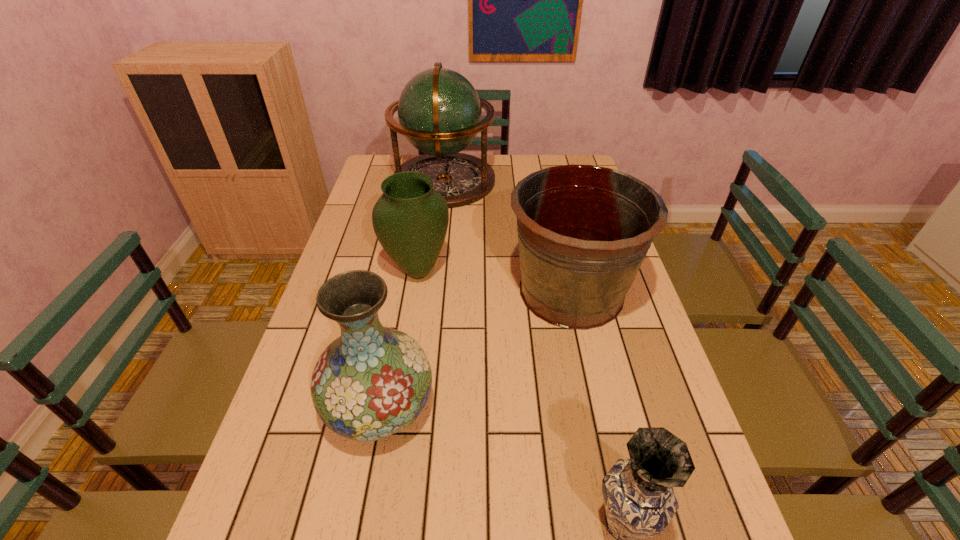
Where is `the farthest object`? The width and height of the screenshot is (960, 540). the farthest object is located at coordinates (439, 111).

Image resolution: width=960 pixels, height=540 pixels. Find the location of `the tallest object`. the tallest object is located at coordinates (439, 111).

Locate an element on the screen. Image resolution: width=960 pixels, height=540 pixels. the second nearest object is located at coordinates (371, 382).

Where is `the second farthest vase`? the second farthest vase is located at coordinates (371, 382).

I want to click on bucket, so click(x=583, y=231).

Locate an element on the screen. This screenshot has height=540, width=960. the farthest vase is located at coordinates (410, 219).

What are the coordinates of `vacant region located 0.200m on the front-facing side of the farthest object` in the screenshot? It's located at (546, 181).

At what (x,y) coordinates should I click in order to perform the action: click on vacant space situated on the back of the second nearest vase. Please return your answer as a coordinate pair (x, y). This screenshot has width=960, height=540. Looking at the image, I should click on (406, 268).

Where is `vacant region located 0.150m on the back of the bucket`? The height and width of the screenshot is (540, 960). vacant region located 0.150m on the back of the bucket is located at coordinates (556, 223).

At what (x,y) coordinates should I click in order to perform the action: click on free location located on the front of the farthest vase. Please return your answer as a coordinate pair (x, y). Looking at the image, I should click on (407, 339).